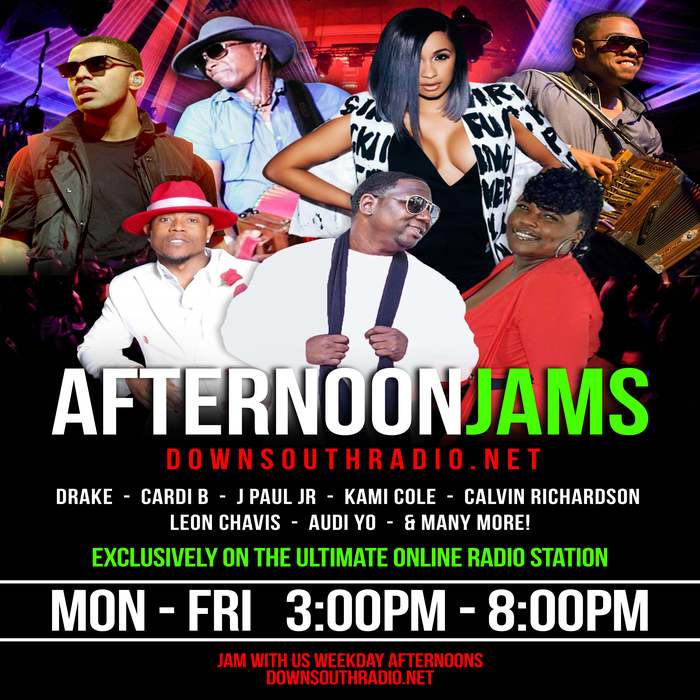
Identify the location of purple lights. (52, 54), (565, 33), (652, 63).